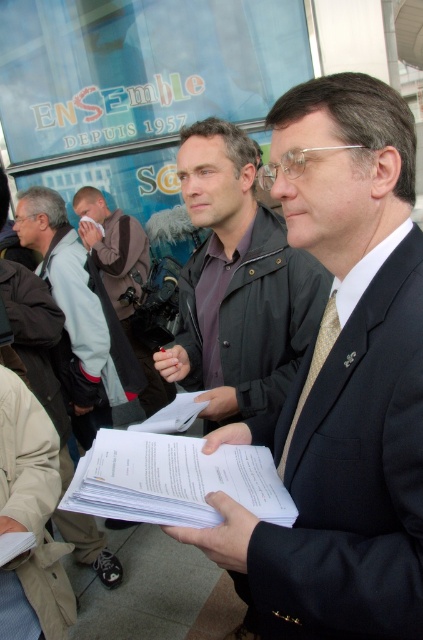
Question: Can you confirm if matte black jacket at center is thinner than brown fuzzy jacket at left?

Choices:
 (A) yes
 (B) no

Answer: (A)

Question: Is matte black jacket at center to the right of gold textured tie at center from the viewer's perspective?

Choices:
 (A) no
 (B) yes

Answer: (A)

Question: Which point is closer to the camera?

Choices:
 (A) (107, 381)
 (B) (338, 515)
 (C) (217, 252)

Answer: (B)

Question: Where is matte black jacket at center located in relation to gold textured tie at center in the image?

Choices:
 (A) above
 (B) below

Answer: (A)

Question: Which point is closer to the camera?

Choices:
 (A) matte black suit at center
 (B) matte black jacket at center
 (C) white paper at center

Answer: (A)

Question: Which of the following is the closest to the observer?

Choices:
 (A) brown fuzzy jacket at left
 (B) gold textured tie at center
 (C) matte black suit at center
 (D) matte black jacket at center

Answer: (C)